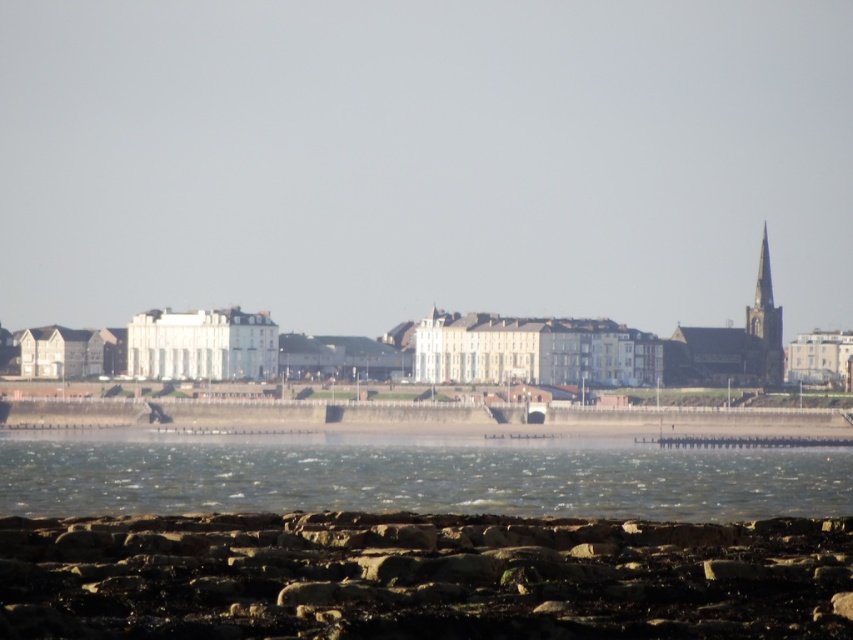
Can you confirm if rusty stone rocks at lower center is positioned above dark gray stone spire at right?

Actually, rusty stone rocks at lower center is below dark gray stone spire at right.

Locate an element on the screen. rusty stone rocks at lower center is located at coordinates (421, 577).

Can you confirm if rusty stone rocks at lower center is wider than clear water at lower center?

Incorrect, rusty stone rocks at lower center's width does not surpass clear water at lower center's.

Can you confirm if rusty stone rocks at lower center is positioned above clear water at lower center?

Yes.

Which is in front, point (430, 579) or point (45, 452)?

Point (430, 579)

This screenshot has height=640, width=853. I want to click on rusty stone rocks at lower center, so click(x=421, y=577).

Locate an element on the screen. This screenshot has height=640, width=853. clear water at lower center is located at coordinates (413, 476).

Find the location of a particular element. This screenshot has width=853, height=640. clear water at lower center is located at coordinates (413, 476).